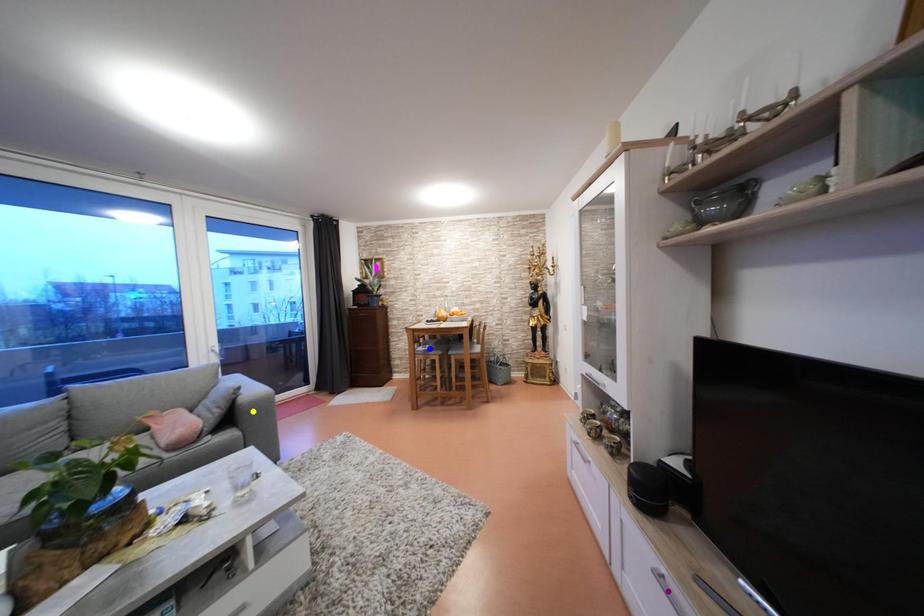
Order these from farthest to nearest:
yellow point | blue point | purple point

blue point → yellow point → purple point